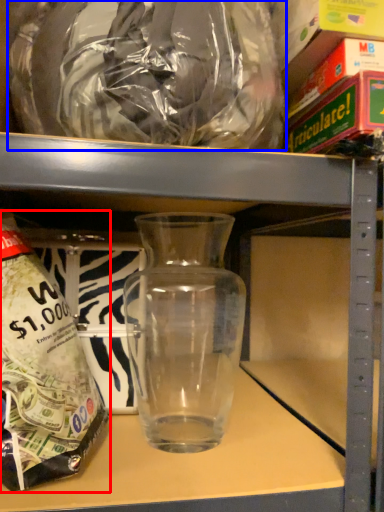
Question: Among these objects, which one is farthest to the camera, bottle (highlighted by a red box) or plastic bag (highlighted by a blue box)?

Choices:
 (A) bottle
 (B) plastic bag

Answer: (A)